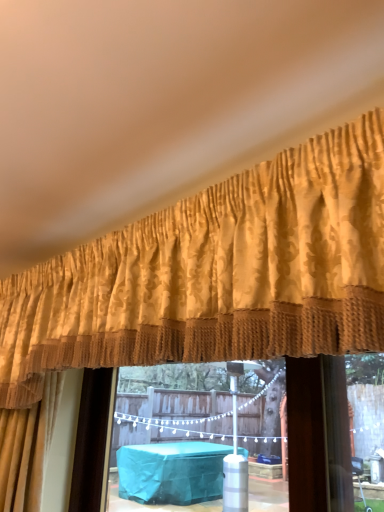
Question: Considering the positions of brown textured curtain at center and gold damask curtain at upper center in the image, is brown textured curtain at center wider or thinner than gold damask curtain at upper center?

Choices:
 (A) wide
 (B) thin

Answer: (B)

Question: Considering the relative positions of brown textured curtain at center and gold damask curtain at upper center in the image provided, is brown textured curtain at center to the left or to the right of gold damask curtain at upper center?

Choices:
 (A) left
 (B) right

Answer: (B)

Question: Would you say brown textured curtain at center is inside or outside gold damask curtain at upper center?

Choices:
 (A) inside
 (B) outside

Answer: (B)

Question: Is gold damask curtain at upper center bigger or smaller than brown textured curtain at center?

Choices:
 (A) small
 (B) big

Answer: (B)

Question: Considering their positions, is gold damask curtain at upper center located in front of or behind brown textured curtain at center?

Choices:
 (A) front
 (B) behind

Answer: (A)

Question: From a real-world perspective, is gold damask curtain at upper center above or below brown textured curtain at center?

Choices:
 (A) below
 (B) above

Answer: (B)

Question: In the image, is gold damask curtain at upper center on the left side or the right side of brown textured curtain at center?

Choices:
 (A) left
 (B) right

Answer: (A)